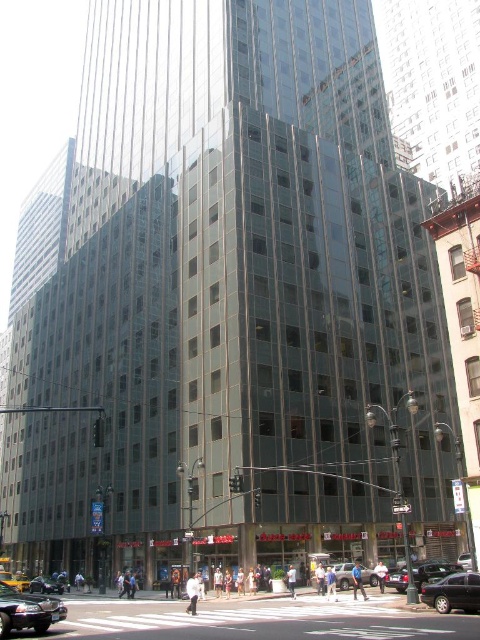
You are standing on the street in front of the building and want to take a photo of the two points mentioned. Which point is closer to you, point (1, 593) or point (447, 582)?

Point (1, 593) is closer to the viewer than point (447, 582).

You are a delivery person who needs to park your van between the shiny black sedan at lower left and the silver metallic suv at center. Your van is 20 feet long. Can you fit your van in the space between them?

The distance between the shiny black sedan at lower left and the silver metallic suv at center is 93.65 feet. Since your van is only 20 feet long, there is more than enough space to park it between them.